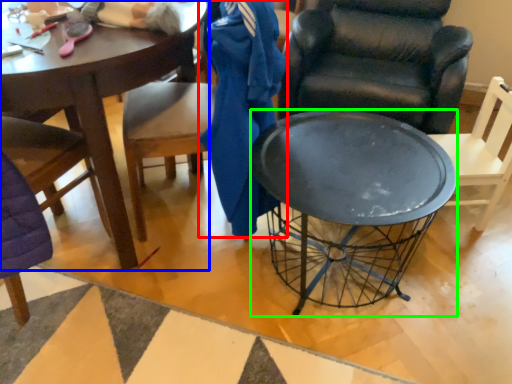
Question: Which is farther away from clothing (highlighted by a red box)? coffee table (highlighted by a blue box) or desk (highlighted by a green box)?

Choices:
 (A) coffee table
 (B) desk

Answer: (A)